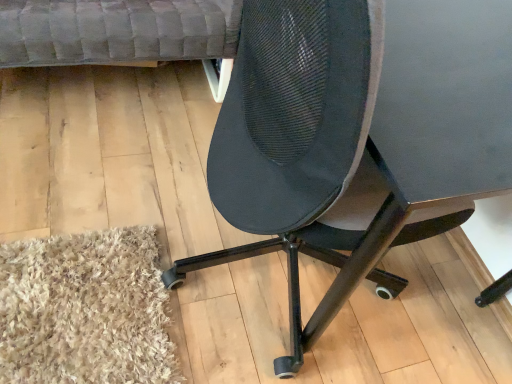
Question: Considering the positions of velvet grey couch at upper left and black mesh chair at center in the image, is velvet grey couch at upper left bigger or smaller than black mesh chair at center?

Choices:
 (A) small
 (B) big

Answer: (A)

Question: From a real-world perspective, is velvet grey couch at upper left above or below black mesh chair at center?

Choices:
 (A) above
 (B) below

Answer: (B)

Question: From the image's perspective, is velvet grey couch at upper left above or below black mesh chair at center?

Choices:
 (A) below
 (B) above

Answer: (B)

Question: Relative to velvet grey couch at upper left, is black mesh chair at center in front or behind?

Choices:
 (A) front
 (B) behind

Answer: (A)

Question: Is point (216, 182) positioned closer to the camera than point (76, 0)?

Choices:
 (A) closer
 (B) farther

Answer: (A)

Question: Is black mesh chair at center to the left or to the right of velvet grey couch at upper left in the image?

Choices:
 (A) left
 (B) right

Answer: (B)

Question: From the image's perspective, is black mesh chair at center located above or below velvet grey couch at upper left?

Choices:
 (A) above
 (B) below

Answer: (B)